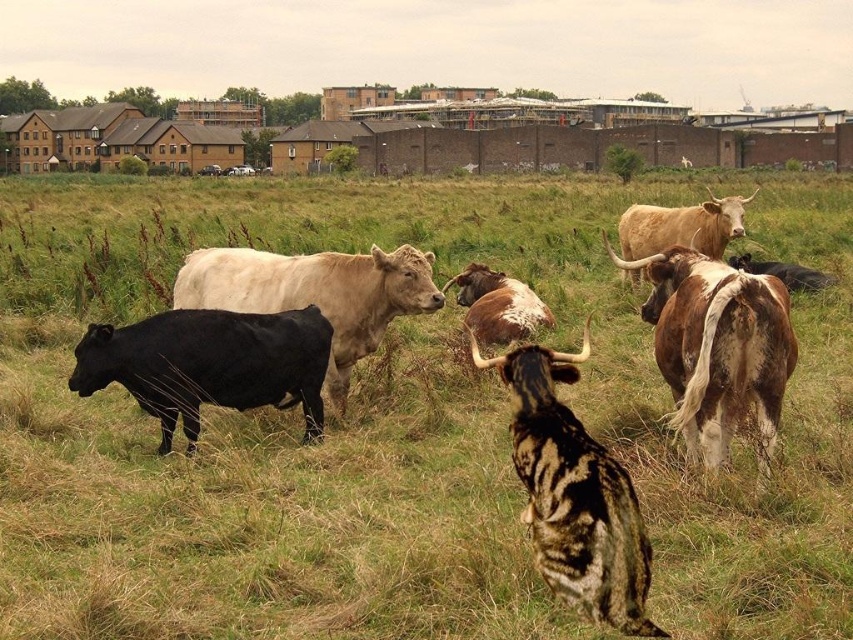
Does black glossy bull at left have a lesser height compared to white woolly bull at center?

Yes, black glossy bull at left is shorter than white woolly bull at center.

I want to click on black glossy bull at left, so click(x=209, y=364).

Describe the element at coordinates (209, 364) in the screenshot. I see `black glossy bull at left` at that location.

This screenshot has width=853, height=640. Identify the location of black glossy bull at left. (209, 364).

Does brown speckled hide at right appear over light brown textured bull at upper right?

No, brown speckled hide at right is not above light brown textured bull at upper right.

The height and width of the screenshot is (640, 853). What do you see at coordinates (717, 348) in the screenshot? I see `brown speckled hide at right` at bounding box center [717, 348].

Between point (724, 396) and point (676, 221), which one is positioned behind?

Point (676, 221)

Identify the location of brown speckled hide at right. (717, 348).

Image resolution: width=853 pixels, height=640 pixels. In order to click on brown speckled hide at right in this screenshot , I will do `click(717, 348)`.

Is brown speckled hide at right smaller than brown speckled hide at center?

No.

Is point (747, 337) more distant than point (480, 337)?

That is False.

Find the location of a particular element. This screenshot has height=640, width=853. brown speckled hide at right is located at coordinates (717, 348).